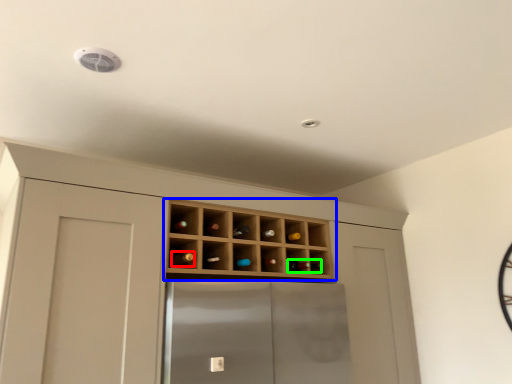
Question: Which object is positioned farthest from wine bottle (highlighted by a red box)? Select from shelf (highlighted by a blue box) and wine bottle (highlighted by a green box).

Choices:
 (A) shelf
 (B) wine bottle

Answer: (B)